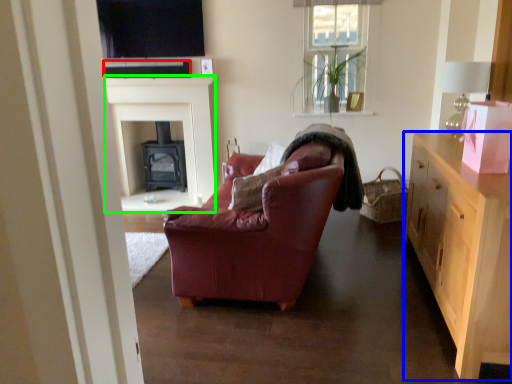
Question: Estimate the real-world distances between objects in this image. Which object is closer to loudspeaker (highlighted by a red box), cabinetry (highlighted by a blue box) or fireplace (highlighted by a green box)?

Choices:
 (A) cabinetry
 (B) fireplace

Answer: (B)